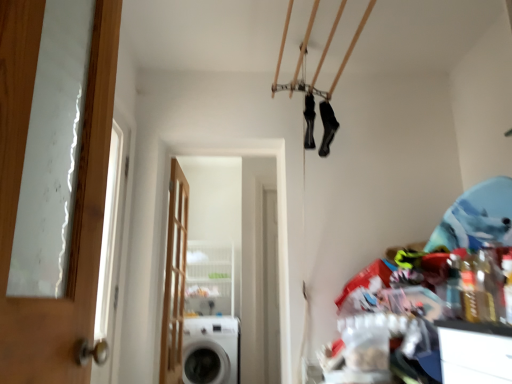
Question: From a real-world perspective, is white glossy screen door at center physically located above or below wooden door at center, the second door viewed from the front?

Choices:
 (A) above
 (B) below

Answer: (A)

Question: Is white glossy screen door at center in front of or behind wooden door at center, which ranks as the first door in left-to-right order, in the image?

Choices:
 (A) behind
 (B) front

Answer: (B)

Question: Which of these objects is positioned closest to the wooden door at left, arranged as the first door when viewed from the front?

Choices:
 (A) black matte shoe at upper center, the 1th shoe viewed from the left
 (B) white glossy washing machine at lower center
 (C) wooden door at center, which ranks as the first door in left-to-right order
 (D) white glossy screen door at center
 (E) black matte socks at upper center, the second shoe from the left

Answer: (A)

Question: Which object is positioned farthest from the white glossy washing machine at lower center?

Choices:
 (A) wooden door at center, which is the second door from right to left
 (B) white glossy screen door at center
 (C) black matte shoe at upper center, the 1th shoe viewed from the left
 (D) wooden door at left, arranged as the 2th door when viewed from the back
 (E) black matte socks at upper center, which ranks as the 1th shoe in right-to-left order

Answer: (D)